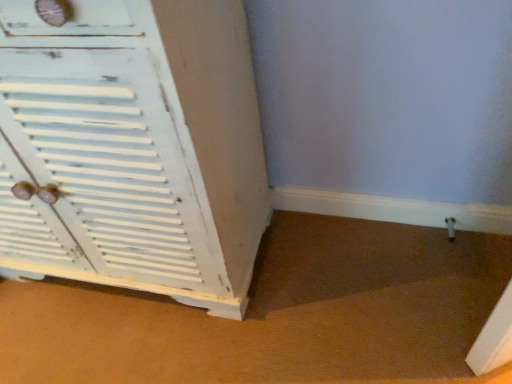
In order to click on white distressed wood chest of drawers at left in this screenshot , I will do `click(135, 147)`.

In order to face white distressed wood chest of drawers at left, should I rotate leftwards or rightwards?

To align with it, rotate left about 22.371°.

Describe the element at coordinates (135, 147) in the screenshot. I see `white distressed wood chest of drawers at left` at that location.

Measure the distance between point (123, 254) and camera.

Result: Point (123, 254) and camera are 1.14 meters apart.

In order to click on white distressed wood chest of drawers at left in this screenshot , I will do `click(135, 147)`.